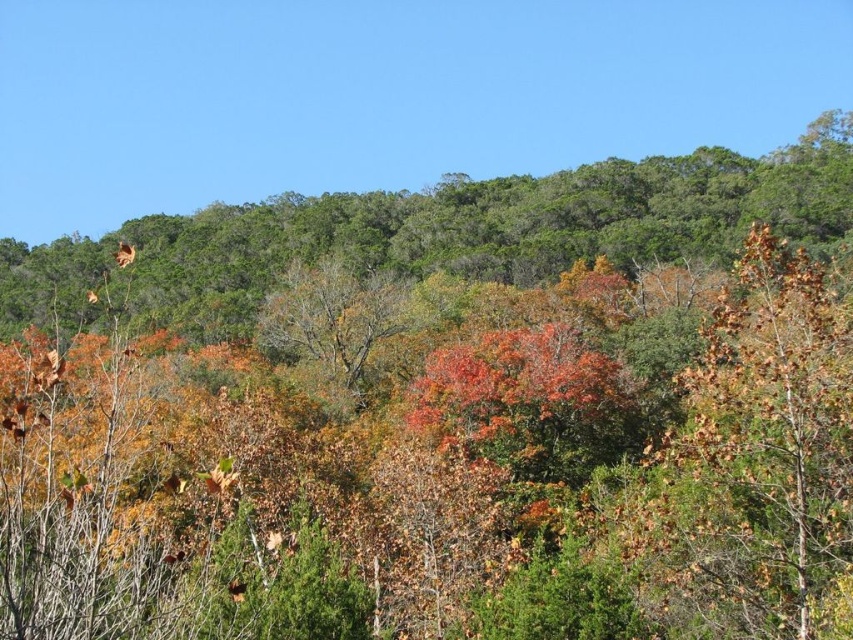
Is point (724, 474) more distant than point (373, 342)?

No.

In order to click on brown/dried leaves at right in this screenshot , I will do `click(756, 454)`.

Is point (730, 337) closer to camera compared to point (363, 284)?

That is True.

Locate an element on the screen. The height and width of the screenshot is (640, 853). brown/dried leaves at right is located at coordinates (756, 454).